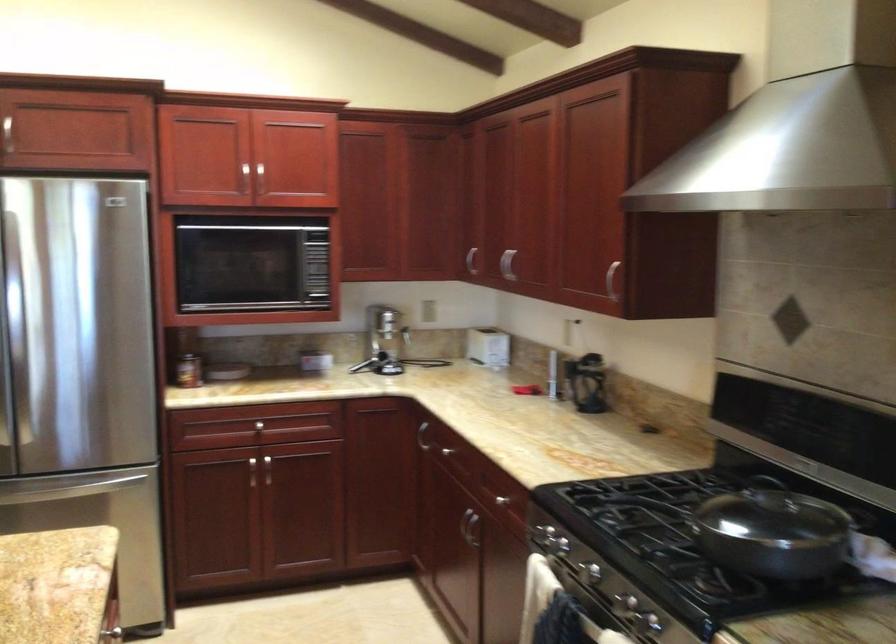
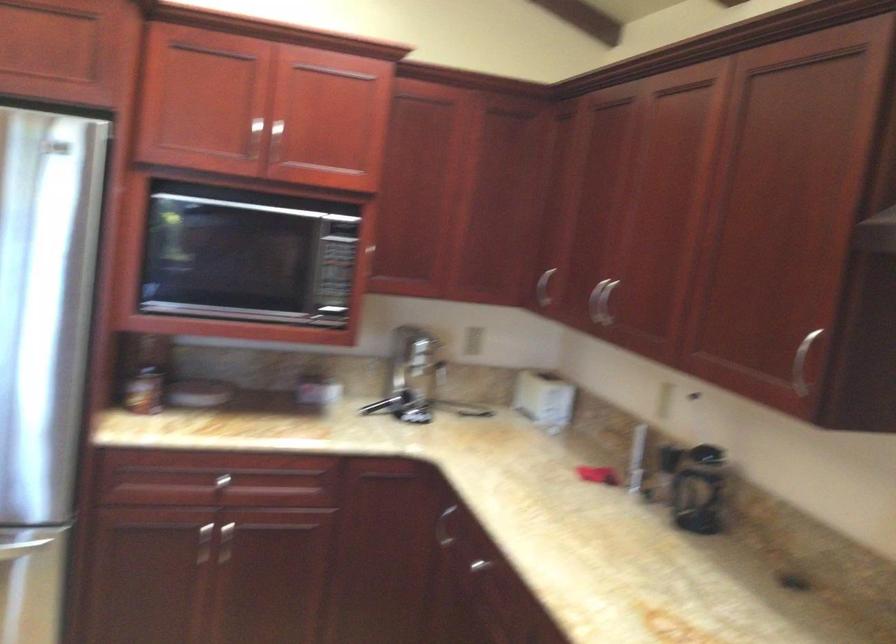
Find the pixel in the second image that matches point (126, 486) in the first image.

(21, 547)